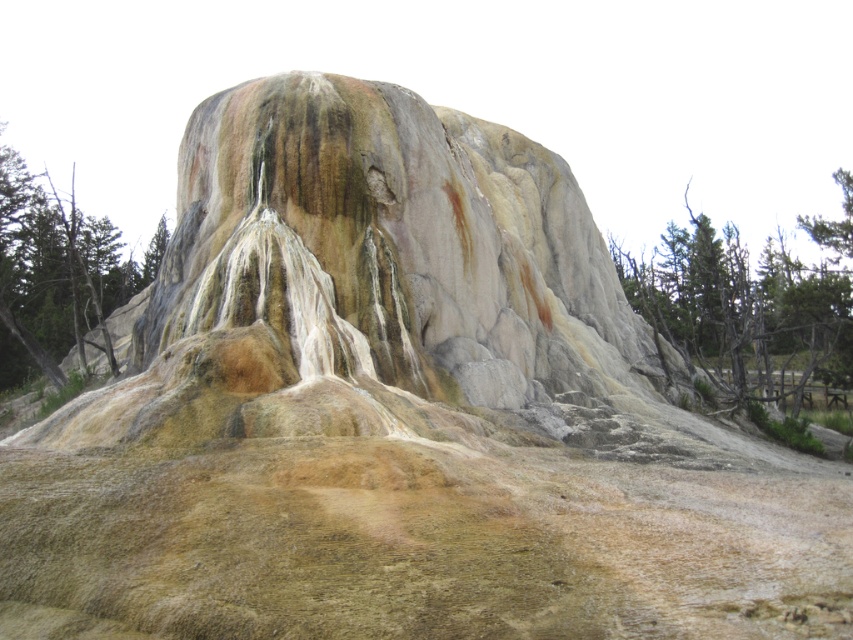
Looking at this image, can you confirm if green leafy trees at upper right is positioned to the right of green rough bark tree at left?

Indeed, green leafy trees at upper right is positioned on the right side of green rough bark tree at left.

Is green leafy trees at upper right to the left of green rough bark tree at left from the viewer's perspective?

Incorrect, green leafy trees at upper right is not on the left side of green rough bark tree at left.

Does point (840, 237) come farther from viewer compared to point (93, 266)?

Yes, point (840, 237) is behind point (93, 266).

Find the location of a particular element. The image size is (853, 640). green leafy trees at upper right is located at coordinates (744, 310).